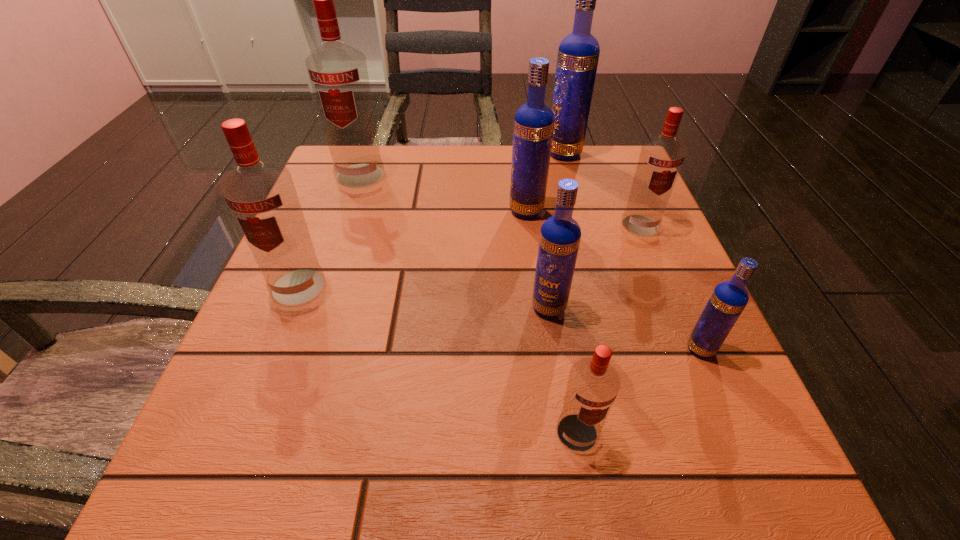
Locate an element on the screen. the nearest blue vodka is located at coordinates (729, 298).

At what (x,y) coordinates should I click in order to perform the action: click on the nearest vodka. Please return your answer as a coordinate pair (x, y). Image resolution: width=960 pixels, height=540 pixels. Looking at the image, I should click on (593, 384).

You are a GUI agent. You are given a task and a screenshot of the screen. Output one action in this format:
    pyautogui.click(x=<x>, y=<y>)
    Task: Click on the nearest red vodka
    This screenshot has width=960, height=540.
    Given the screenshot: What is the action you would take?
    pyautogui.click(x=593, y=384)

You are a GUI agent. You are given a task and a screenshot of the screen. Output one action in this format:
    pyautogui.click(x=<x>, y=<y>)
    Task: Click on the blank area located on the left of the third object from right to left
    This screenshot has height=540, width=960.
    Given the screenshot: What is the action you would take?
    pyautogui.click(x=388, y=153)

Identify the location of blank space located 0.230m on the front label of the biggest red vodka. The width and height of the screenshot is (960, 540). (330, 260).

Locate an element on the screen. This screenshot has width=960, height=540. blank area located on the left of the third smallest blue vodka is located at coordinates pyautogui.click(x=408, y=211).

You are a GUI agent. You are given a task and a screenshot of the screen. Output one action in this format:
    pyautogui.click(x=<x>, y=<y>)
    Task: Click on the free point located 0.130m on the front label of the third smallest red vodka
    This screenshot has width=960, height=540.
    Given the screenshot: What is the action you would take?
    pyautogui.click(x=263, y=374)

This screenshot has height=540, width=960. I want to click on free space located on the right of the second smallest blue vodka, so click(x=657, y=307).

The width and height of the screenshot is (960, 540). Identify the location of vacant space situated 0.330m on the front label of the rightmost red vodka. (707, 386).

Where is `vacant space situated on the left of the seventh farthest object`? vacant space situated on the left of the seventh farthest object is located at coordinates (621, 349).